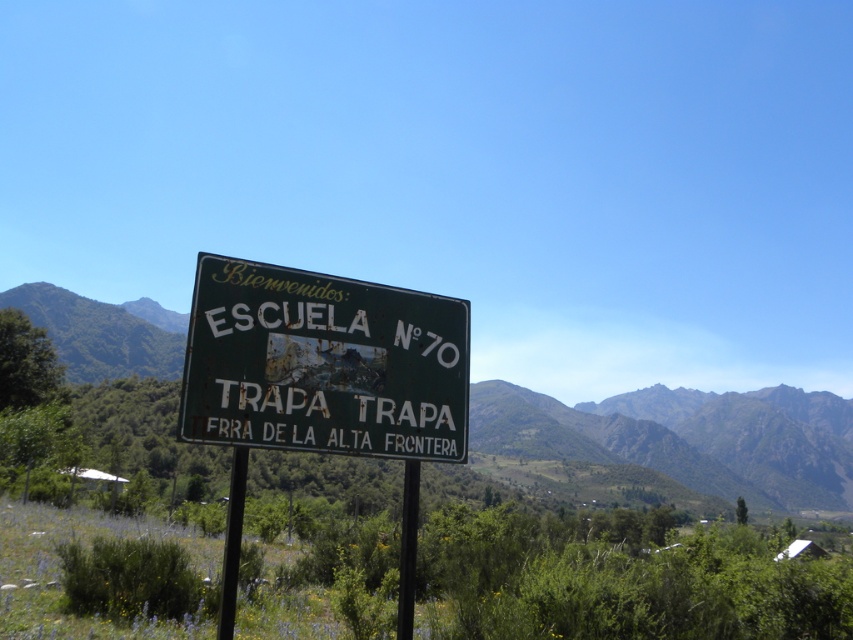
Looking at this image, who is lower down, green grassy mountain at center or metallic pole at center?

green grassy mountain at center is lower down.

Can you confirm if green grassy mountain at center is bigger than metallic pole at center?

Yes.

Which is behind, point (657, 406) or point (228, 573)?

The point (657, 406) is behind.

What are the coordinates of `green grassy mountain at center` in the screenshot? It's located at (686, 436).

Is rusty metal sign at center closer to camera compared to green grassy mountain at center?

Yes.

Who is more distant from viewer, (227,413) or (476,410)?

The point (476,410) is behind.

Is point (311, 362) positioned behind point (625, 435)?

No, it is in front of (625, 435).

At what (x,y) coordinates should I click in order to perform the action: click on rusty metal sign at center. Please return your answer as a coordinate pair (x, y). Image resolution: width=853 pixels, height=640 pixels. Looking at the image, I should click on (323, 364).

Is green grassy mountain at center taller than black metal pole at center?

Yes.

The image size is (853, 640). What do you see at coordinates (686, 436) in the screenshot? I see `green grassy mountain at center` at bounding box center [686, 436].

Identify the location of green grassy mountain at center. (686, 436).